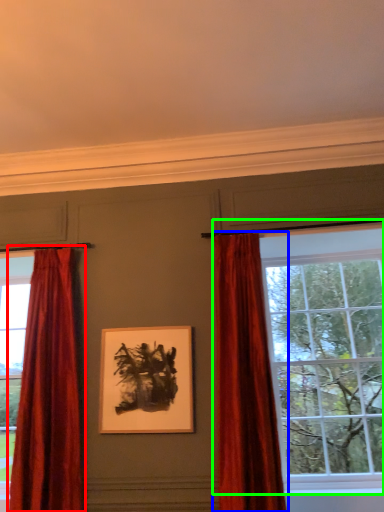
Question: Which object is the farthest from curtain (highlighted by a red box)? Choose among these: curtain (highlighted by a blue box) or window (highlighted by a green box).

Choices:
 (A) curtain
 (B) window

Answer: (B)